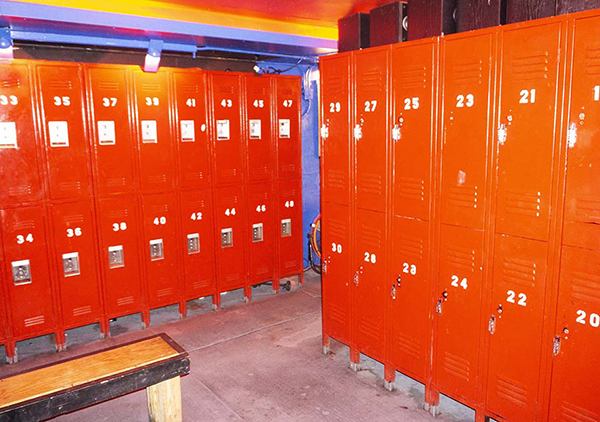
The width and height of the screenshot is (600, 422). I want to click on electric wires, so click(306, 110), click(306, 80), click(308, 75), click(299, 68).